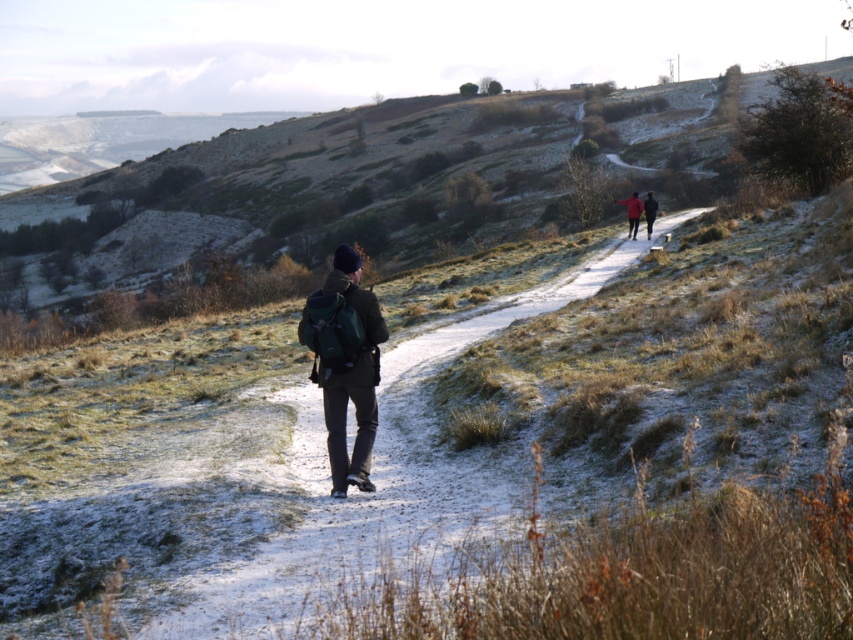
Between point (386, 493) and point (646, 230), which one is positioned in front?

Point (386, 493)

Is snowy dirt path at center taller than red woolen jacket at upper right?

Indeed, snowy dirt path at center has a greater height compared to red woolen jacket at upper right.

Describe the element at coordinates (375, 477) in the screenshot. This screenshot has height=640, width=853. I see `snowy dirt path at center` at that location.

Image resolution: width=853 pixels, height=640 pixels. Find the location of `snowy dirt path at center`. snowy dirt path at center is located at coordinates (375, 477).

Which is more to the right, snowy dirt path at center or red fabric jacket at upper center?

red fabric jacket at upper center

Which is behind, point (364, 504) or point (618, 202)?

The point (618, 202) is more distant.

Does point (297, 452) lie behind point (637, 202)?

No.

The width and height of the screenshot is (853, 640). Find the location of `snowy dirt path at center`. snowy dirt path at center is located at coordinates (375, 477).

Can you confirm if dark green backpack at center is bigger than red woolen jacket at upper right?

Incorrect, dark green backpack at center is not larger than red woolen jacket at upper right.

Is point (315, 308) more distant than point (651, 202)?

No, it is in front of (651, 202).

Where is `dark green backpack at center`? dark green backpack at center is located at coordinates (345, 364).